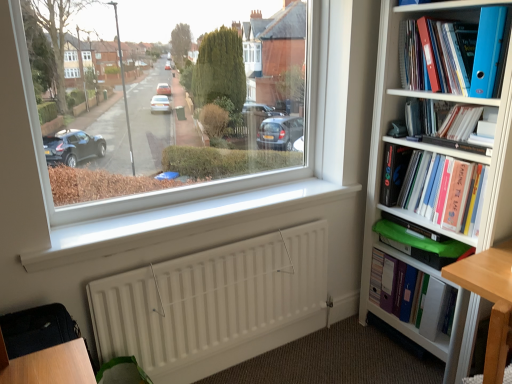
Where is `blank space situated above white smooth window sill at center (from a real-world perspective)`? This screenshot has height=384, width=512. blank space situated above white smooth window sill at center (from a real-world perspective) is located at coordinates (225, 203).